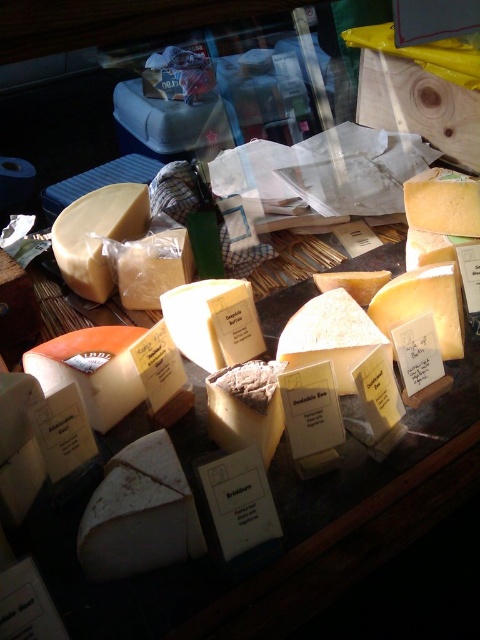
Can you confirm if matte yellow cheese at center is wider than golden hard cheese at center?

Yes.

Who is positioned more to the right, matte yellow cheese at center or golden hard cheese at center?

golden hard cheese at center is more to the right.

You are a GUI agent. You are given a task and a screenshot of the screen. Output one action in this format:
    pyautogui.click(x=<x>, y=<y>)
    Task: Click on the matte yellow cheese at center
    Image resolution: width=480 pixels, height=640 pixels.
    Given the screenshot: What is the action you would take?
    pyautogui.click(x=97, y=236)

Locate an element on the screen. The image size is (480, 640). matte yellow cheese at center is located at coordinates (97, 236).

Is yellow semi-hard cheese at center below matte yellow cheese at center?

Yes.

Is yellow semi-hard cheese at center thinner than matte yellow cheese at center?

Incorrect, yellow semi-hard cheese at center's width is not less than matte yellow cheese at center's.

What do you see at coordinates (359, 476) in the screenshot?
I see `yellow semi-hard cheese at center` at bounding box center [359, 476].

You are a GUI agent. You are given a task and a screenshot of the screen. Output one action in this format:
    pyautogui.click(x=<x>, y=<y>)
    Task: Click on the yellow semi-hard cheese at center
    This screenshot has height=640, width=480.
    Given the screenshot: What is the action you would take?
    pyautogui.click(x=359, y=476)

At what (x,y) coordinates should I click in order to perform the action: click on yellow semi-hard cheese at center. Please return your answer as a coordinate pair (x, y). Looking at the image, I should click on (359, 476).

Which is behind, point (129, 420) or point (228, 356)?

Positioned behind is point (228, 356).

This screenshot has height=640, width=480. Find the location of `yellow semi-hard cheese at center`. yellow semi-hard cheese at center is located at coordinates (359, 476).